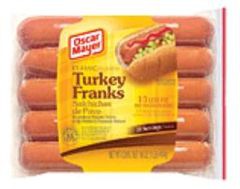
You are a GUI agent. You are given a task and a screenshot of the screen. Output one action in this format:
    pyautogui.click(x=<x>, y=<y>)
    Task: Click on the decorative design
    Image resolution: width=240 pixels, height=189 pixels.
    Given the screenshot: What is the action you would take?
    pyautogui.click(x=144, y=141)